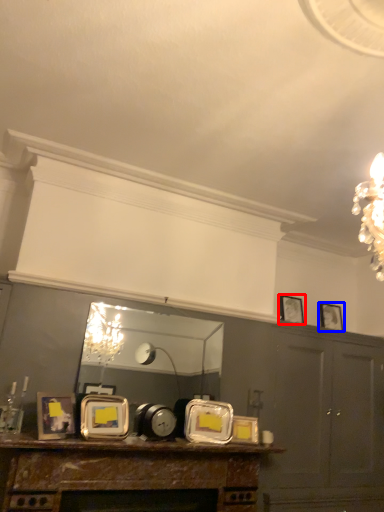
Question: Among these objects, which one is farthest to the camera, picture frame (highlighted by a red box) or picture frame (highlighted by a blue box)?

Choices:
 (A) picture frame
 (B) picture frame

Answer: (B)